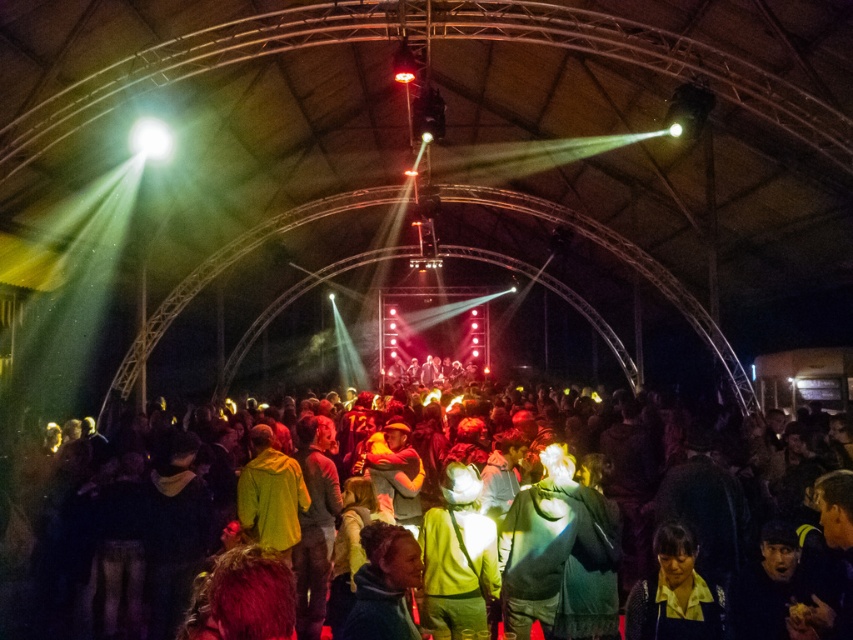
Question: Is green fabric shirt at center above green fabric jacket at center?

Choices:
 (A) no
 (B) yes

Answer: (A)

Question: Which point is farther from the camera taking this photo?

Choices:
 (A) (354, 577)
 (B) (593, 556)
 (C) (300, 624)

Answer: (C)

Question: Which object is the farthest from the green fabric shirt at center?

Choices:
 (A) yellow fabric shirt at lower right
 (B) green fabric jacket at center
 (C) matte green jacket at center

Answer: (B)

Question: Which object is closer to the camera taking this photo?

Choices:
 (A) yellow fabric shirt at lower right
 (B) green fabric jacket at center
 (C) matte green jacket at center
 (D) green fabric shirt at center

Answer: (B)

Question: Does matte green jacket at center appear on the right side of yellow fabric shirt at lower right?

Choices:
 (A) no
 (B) yes

Answer: (A)

Question: Can you confirm if green fabric shirt at center is smaller than matte green jacket at center?

Choices:
 (A) no
 (B) yes

Answer: (A)